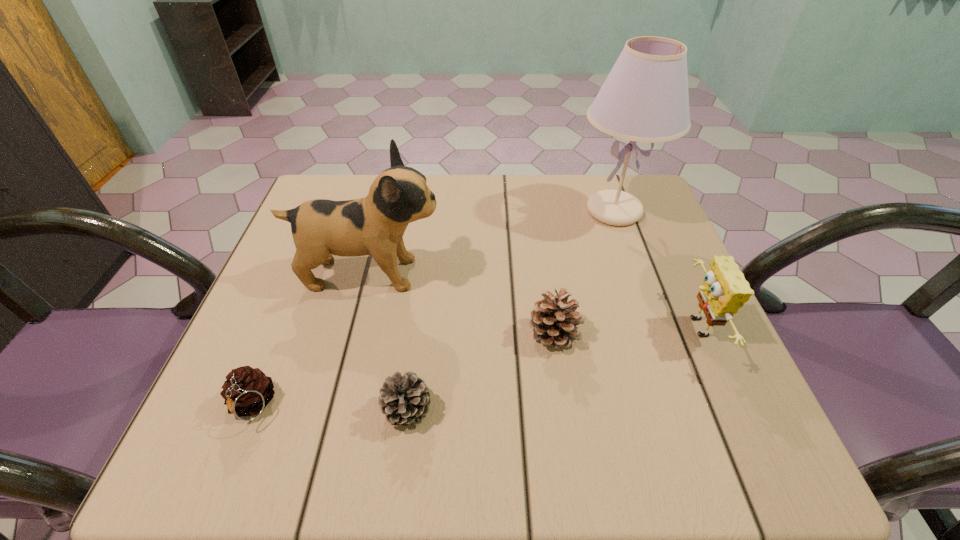
Locate an element on the screen. free point between the tallest object and the second pinecone from left to right is located at coordinates (511, 310).

The height and width of the screenshot is (540, 960). I want to click on free space between the fifth shortest object and the sponge, so click(533, 301).

At what (x,y) coordinates should I click in order to perform the action: click on free spot between the lampshade and the fifth shortest object. Please return your answer as a coordinate pair (x, y). Image resolution: width=960 pixels, height=540 pixels. Looking at the image, I should click on (492, 242).

Find the location of `free space between the tallest object and the leftmost pinecone`. free space between the tallest object and the leftmost pinecone is located at coordinates (433, 308).

The height and width of the screenshot is (540, 960). In order to click on empty location between the leftmost pinecone and the tallest object in this screenshot , I will do `click(433, 308)`.

Find the location of a particular element. vacant area that lies between the farthest object and the leftmost pinecone is located at coordinates (433, 308).

The image size is (960, 540). Identify the location of vacant space that's between the tallest object and the fifth shortest object. (492, 242).

Find the location of a particular element. The height and width of the screenshot is (540, 960). free space that is in between the sponge and the tallest object is located at coordinates (655, 269).

The width and height of the screenshot is (960, 540). What are the coordinates of `object that is the closest one to the tallest pinecone` in the screenshot? It's located at (321, 228).

Select which object is the third closest to the second pinecone from right to left. Please provide its 2D coordinates. Your answer should be formatted as a tuple, i.e. [(x, y)], where the tuple contains the x and y coordinates of a point satisfying the conditions above.

[(321, 228)]